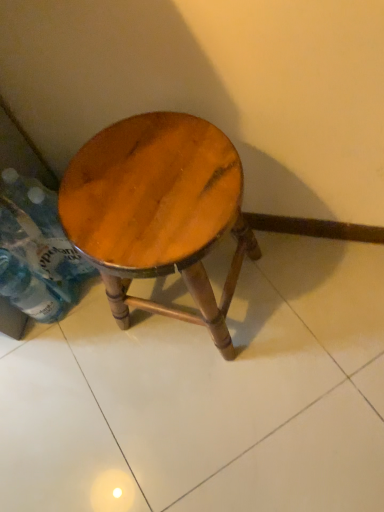
The height and width of the screenshot is (512, 384). I want to click on vacant point above wooden stool at center (from a real-world perspective), so click(x=145, y=185).